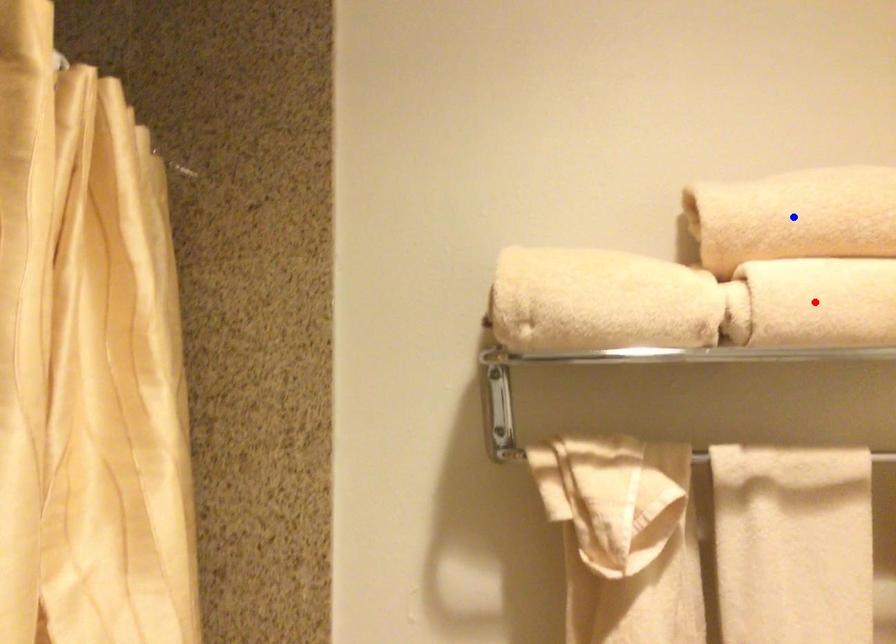
Question: Two points are marked on the image. Which point is closer to the camera?

Choices:
 (A) Blue point is closer.
 (B) Red point is closer.

Answer: (B)